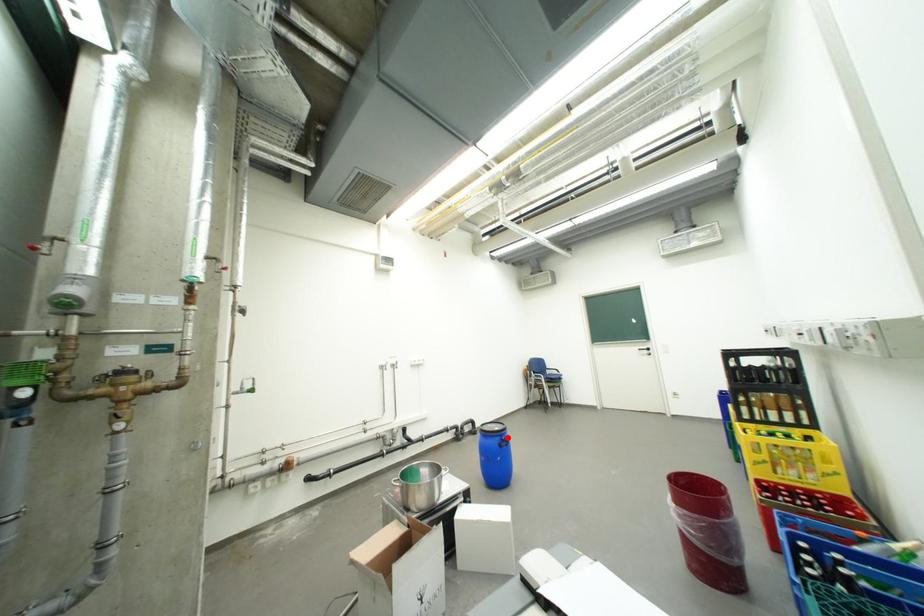
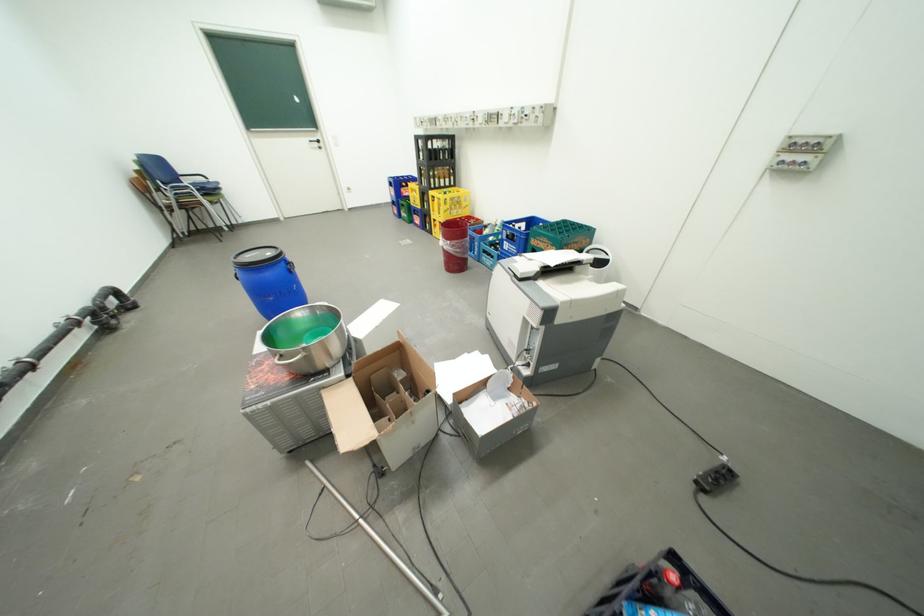
Locate, in the second image, the point that corresponds to the highlighted location in the first image.

(290, 262)